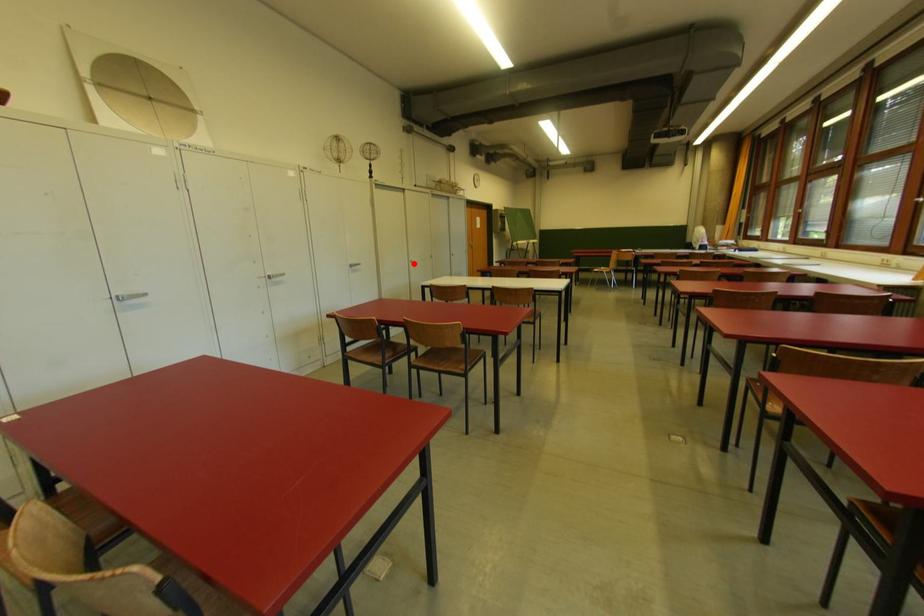
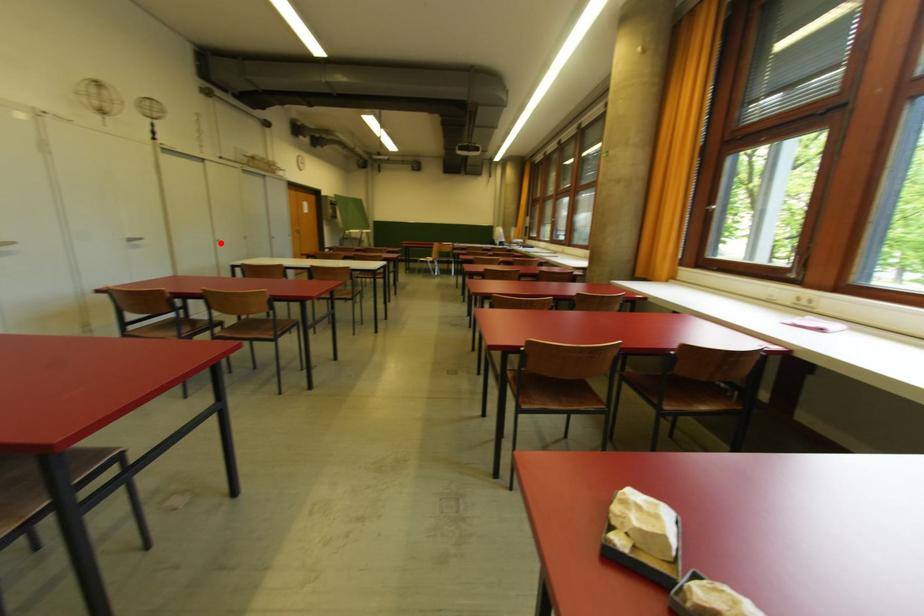
I am providing you with two images of the same scene from different viewpoints. A red point is marked on the first image and another point is marked on the second image. Does the point marked in image1 correspond to the same location as the one in image2?

Yes